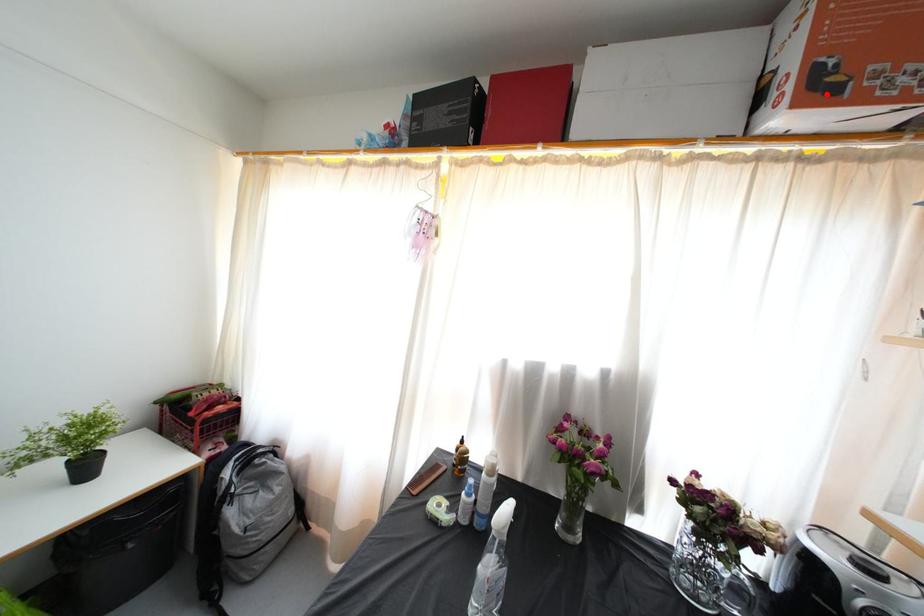
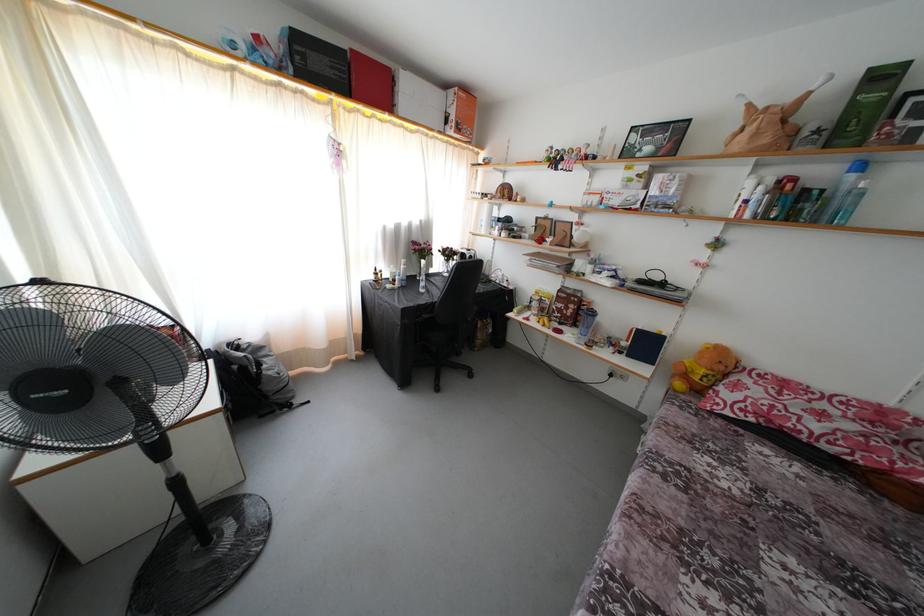
Find the pixel in the second image that matches the highlighted location in the first image.

(463, 134)